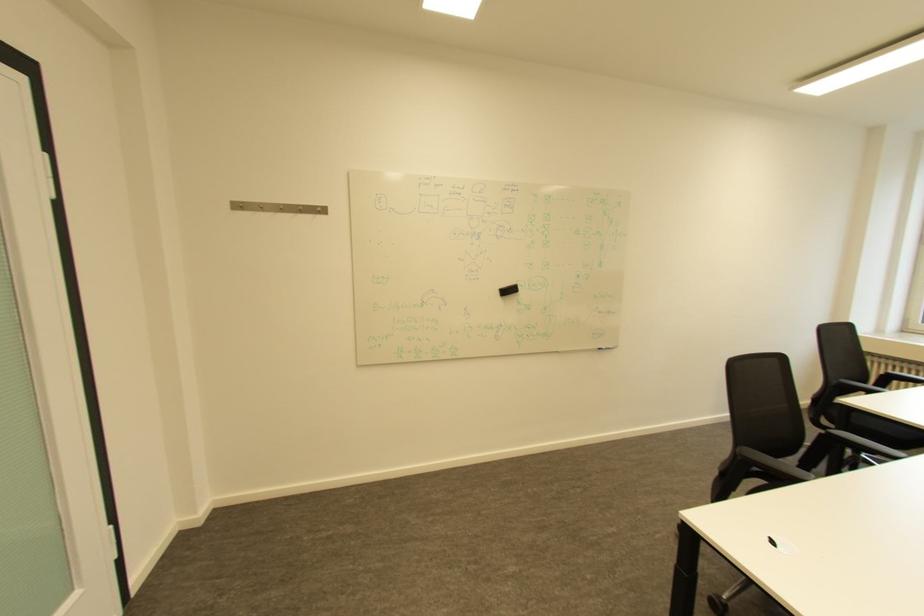
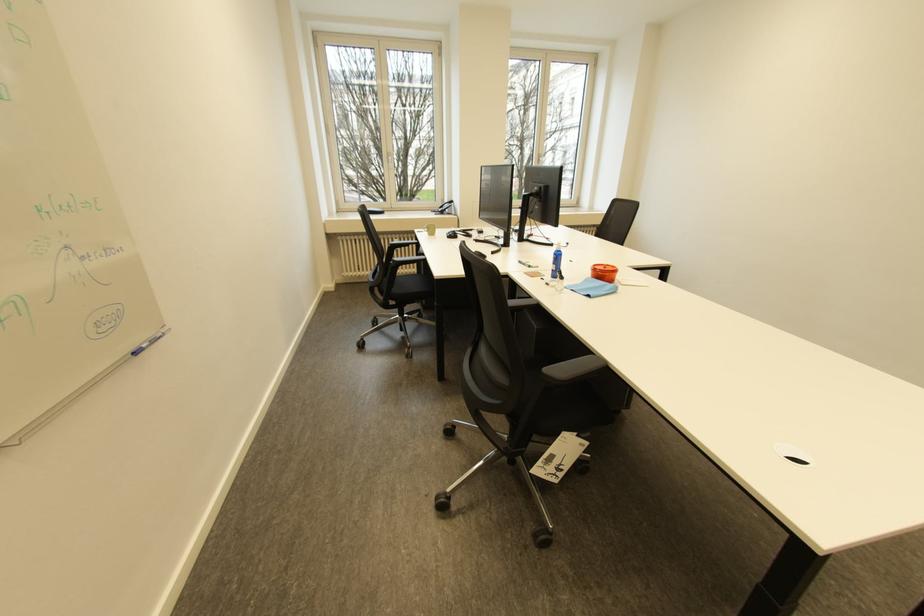
Locate, in the second image, the point that corresponds to pixel 609 347 in the first image.

(141, 350)